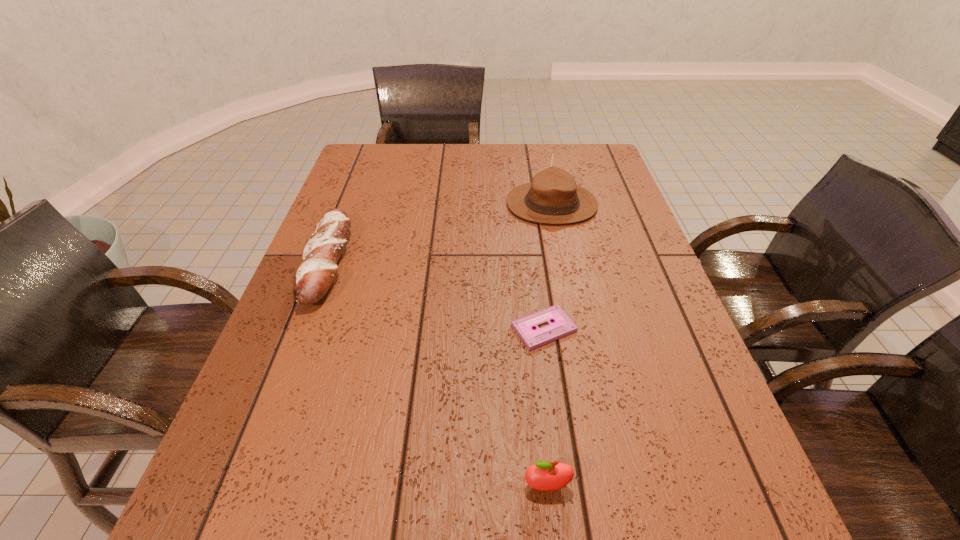
Identify the location of free point that satisfies the following two spatial constraints: 1. on the feather side of the tallest object; 2. on the front side of the second shortest object. This screenshot has height=540, width=960. (564, 262).

This screenshot has width=960, height=540. I want to click on vacant region that satisfies the following two spatial constraints: 1. on the front side of the baguet; 2. on the left side of the shortest object, so click(x=302, y=328).

At what (x,y) coordinates should I click in order to perform the action: click on vacant region that satisfies the following two spatial constraints: 1. on the feather side of the tallest object; 2. on the front side of the baguet. Please return your answer as a coordinate pair (x, y). Image resolution: width=960 pixels, height=540 pixels. Looking at the image, I should click on (564, 262).